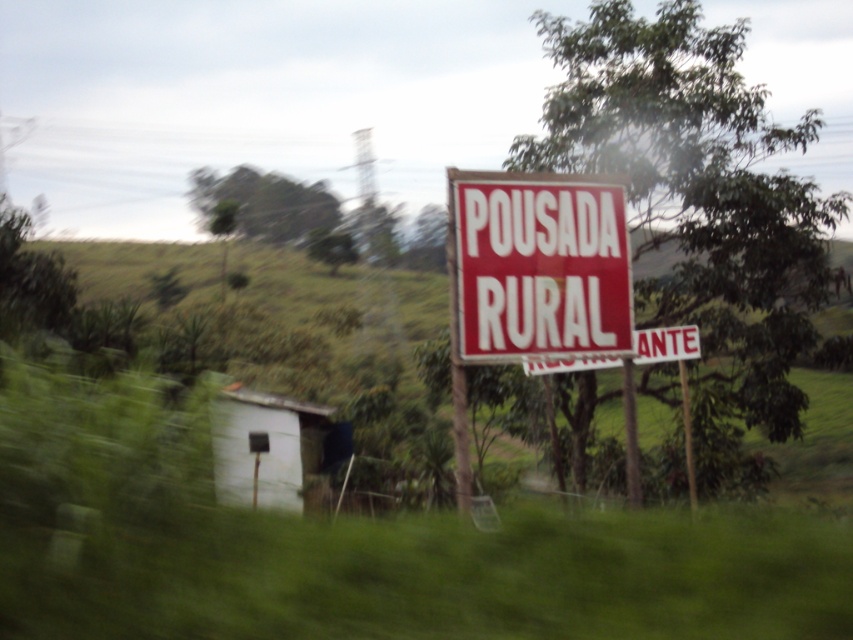
You are standing at the entrance of the rural area and see the green leafy tree at upper right and the white matte hut at lower left. Which object is positioned to the right side of the other?

The green leafy tree at upper right is to the right of the white matte hut at lower left.

You are standing at the point with coordinates point (531, 272) and want to walk towards point (263, 412). Based on the scene description, will you have an unobstructed path to reach your destination?

Point (531, 272) is in front of point (263, 412), so you will have an unobstructed path to reach your destination.

You are a hiker planning to take a photo of the green leafy tree at upper right and the red matte sign at center. Which object should you focus on first if you want to capture both in a single frame without moving the camera?

The green leafy tree at upper right is bigger than the red matte sign at center, so you should focus on the green leafy tree at upper right first to ensure it fits properly in the frame.